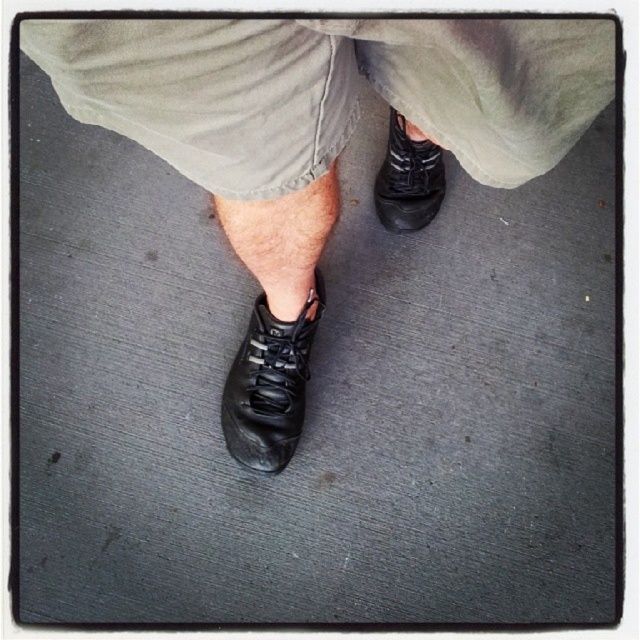
Is matte khaki shorts at center positioned at the back of black leather shoe at center?

No, it is in front of black leather shoe at center.

This screenshot has height=640, width=640. In order to click on matte khaki shorts at center in this screenshot , I will do (x=328, y=90).

The width and height of the screenshot is (640, 640). I want to click on matte khaki shorts at center, so click(328, 90).

Does point (428, 170) come farther from viewer compared to point (312, 276)?

Yes, point (428, 170) is farther from viewer.

Does black leather shoe at center have a lesser height compared to matte black shoe at lower center?

In fact, black leather shoe at center may be taller than matte black shoe at lower center.

Image resolution: width=640 pixels, height=640 pixels. Identify the location of black leather shoe at center. (406, 179).

You are a GUI agent. You are given a task and a screenshot of the screen. Output one action in this format:
    pyautogui.click(x=<x>, y=<y>)
    Task: Click on the black leather shoe at center
    The image size is (640, 640).
    Given the screenshot: What is the action you would take?
    pyautogui.click(x=406, y=179)

Who is positioned more to the right, matte khaki shorts at center or black leather shoe at lower left?

Positioned to the right is matte khaki shorts at center.

Which is in front, point (339, 36) or point (289, 326)?

Point (339, 36) is more forward.

Locate an element on the screen. This screenshot has width=640, height=640. matte khaki shorts at center is located at coordinates (328, 90).